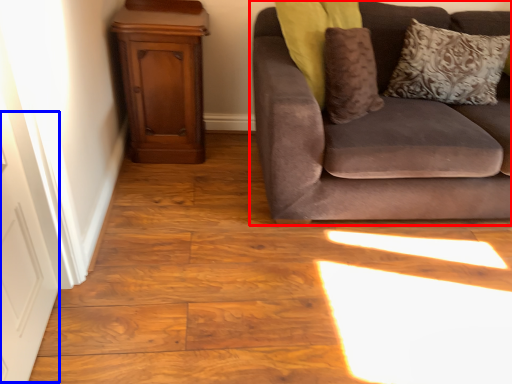
Question: Among these objects, which one is nearest to the camera, studio couch (highlighted by a red box) or door (highlighted by a blue box)?

Choices:
 (A) studio couch
 (B) door

Answer: (B)